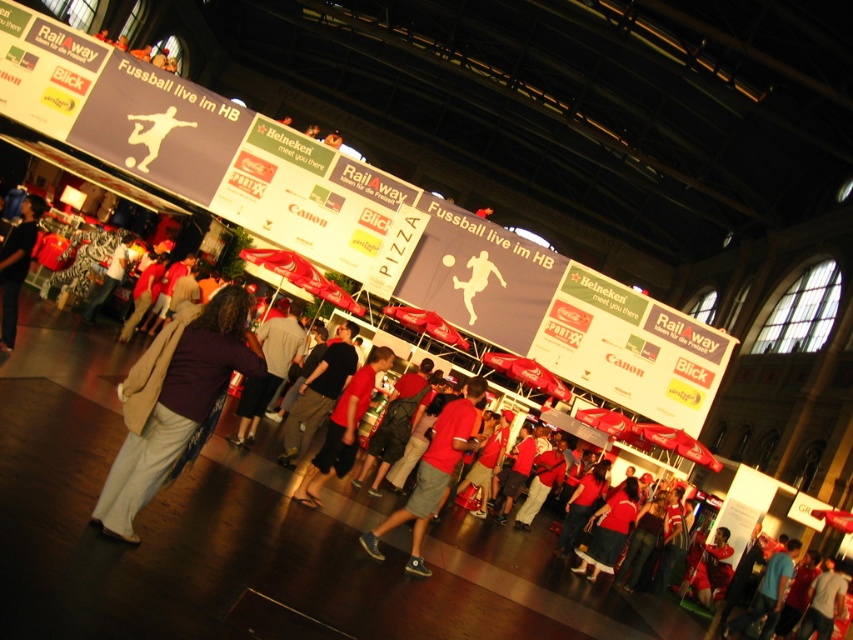
You are a photographer at the event and want to capture both the red cotton shirt at center and the dark gray jacket at left in the same frame. Which clothing item should you focus on first to ensure both are in the frame?

The red cotton shirt at center has a lesser height compared to dark gray jacket at left, so you should focus on the dark gray jacket at left first to ensure both are in the frame.